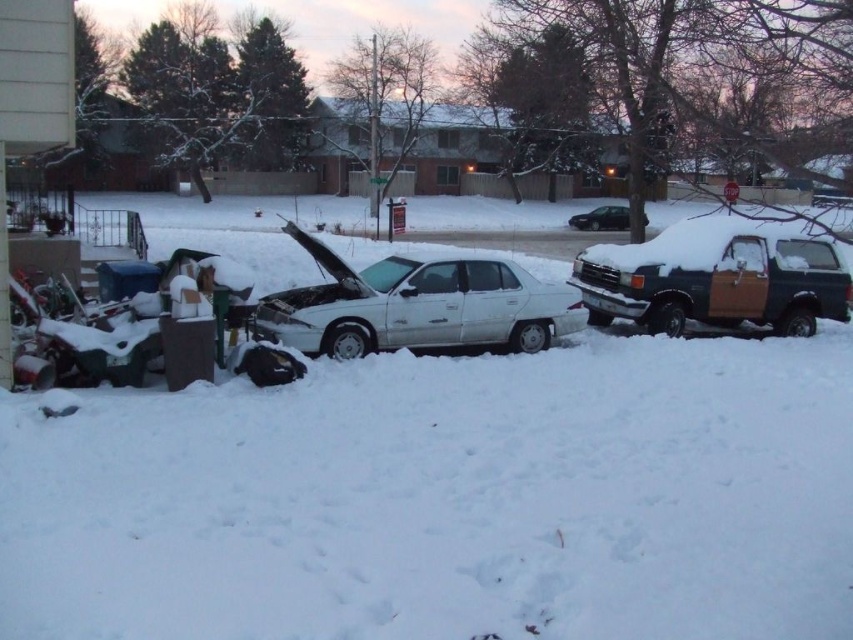
You are a tow truck operator who needs to tow the white matte sedan at center and the dark blue wood panel truck at right. Considering their heights, which vehicle should you tow first to ensure the tow bar doesn

The white matte sedan at center is taller than the dark blue wood panel truck at right. You should tow the white matte sedan at center first because its height may require a higher tow bar setting or adjustment before towing the shorter truck.

You are standing in the snowy residential area and want to place a small flag at the point closer to you between point (360, 348) and point (621, 228). Which point should you choose?

You should choose point (360, 348) because it is closer to you than point (621, 228).